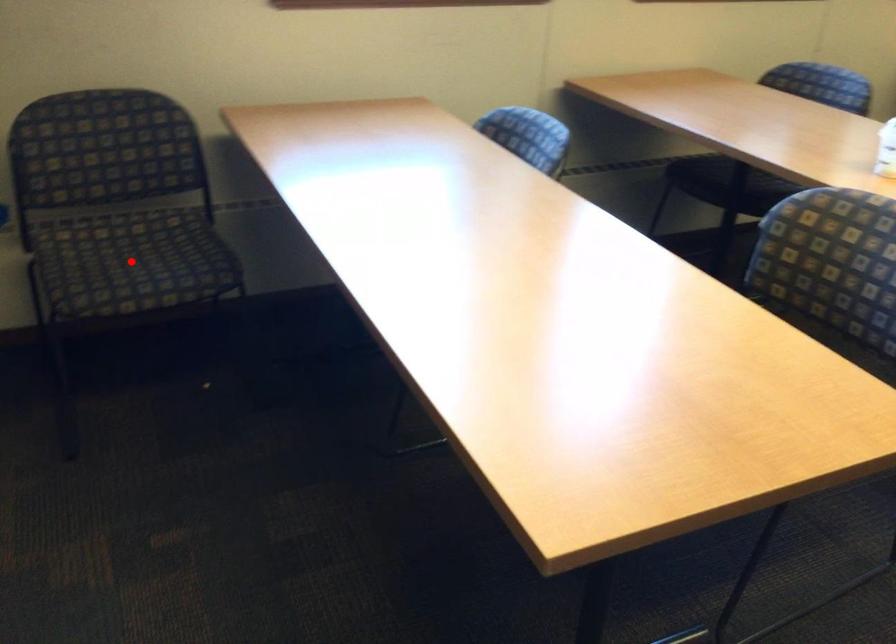
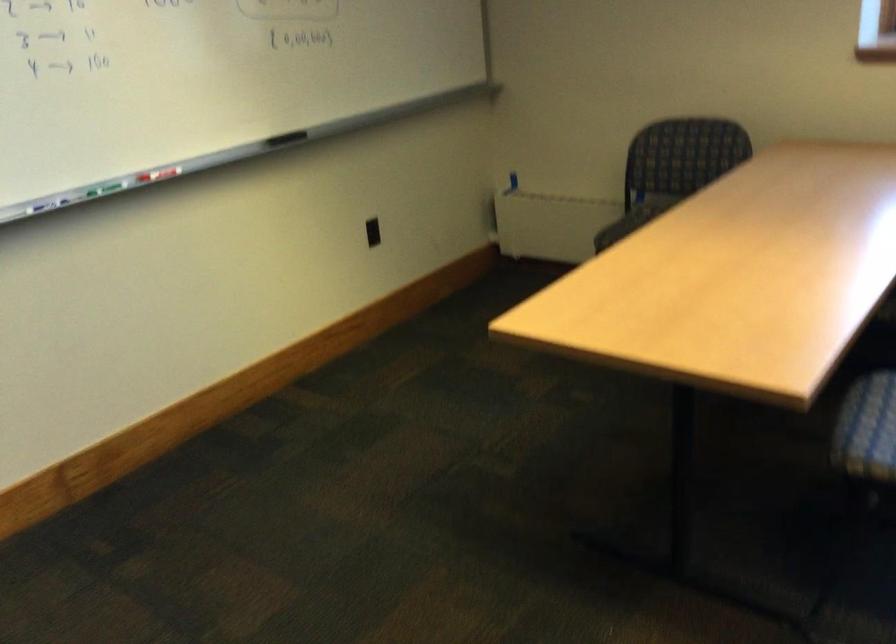
Question: I am providing you with two images of the same scene from different viewpoints. A red point is marked on the first image. Can you still see the location of the red point in image 2?

Choices:
 (A) Yes
 (B) No

Answer: (B)